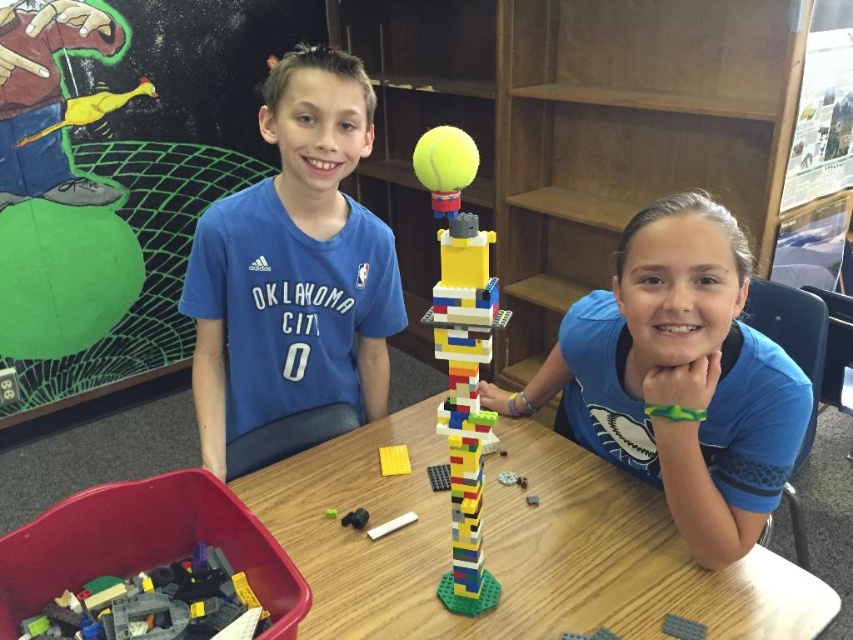
You are a teacher in the classroom. You need to hand out a worksheet to both children. The worksheet is placed on the desk between the blue jersey at center and the green rubber toy at center. Since the worksheet is only 18 inches wide, will it fit between them without overlapping either object?

The blue jersey at center is 19.17 inches away from the green rubber toy at center. Since the worksheet is only 18 inches wide, it will fit between them without overlapping either object because the distance between the two objects is greater than the worksheet width.

You are a teacher in a classroom where two children are sitting at a wooden table. You notice a yellow matte rubber duck at upper left and a green rubber toy at center. If you want to place a new toy between them, how far apart should you position them to maintain the same spacing as the existing toys?

The yellow matte rubber duck at upper left is 6.49 feet away from the green rubber toy at center. To maintain the same spacing, the new toy should be placed exactly halfway between them, which would be 3.245 feet from each existing toy.

You are a teacher observing the classroom scene. You notice the translucent gray plastic bricks at lower left. Where exactly are they located in terms of their 2D coordinates?

The translucent gray plastic bricks at lower left are located at the 2D coordinates of point [157,604].